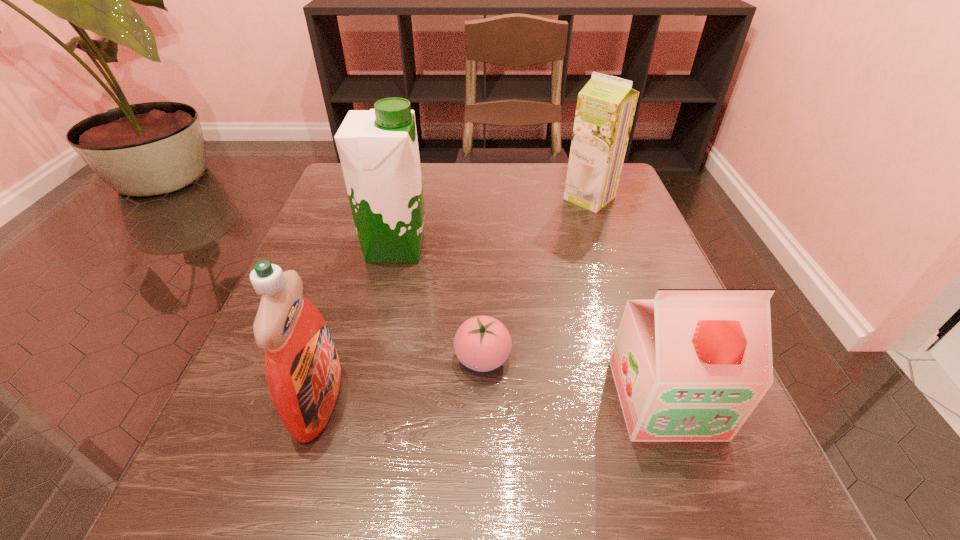
Locate an element on the screen. vacant space located 0.140m on the front surface of the detergent is located at coordinates (439, 400).

Where is `vacant area situated with the cap open on the nearest soya milk`? vacant area situated with the cap open on the nearest soya milk is located at coordinates (694, 480).

Find the location of a particular element. This screenshot has width=960, height=540. free region located on the left of the tomato is located at coordinates (326, 359).

Identify the location of object present at the far edge. Image resolution: width=960 pixels, height=540 pixels. (606, 105).

At what (x,y) coordinates should I click in order to perform the action: click on soya milk that is at the left edge. Please return your answer as a coordinate pair (x, y). Looking at the image, I should click on (378, 148).

Image resolution: width=960 pixels, height=540 pixels. In order to click on detergent that is at the left edge in this screenshot , I will do `click(302, 368)`.

Identify the location of object situated at the far right corner. Image resolution: width=960 pixels, height=540 pixels. (606, 105).

At what (x,y) coordinates should I click in order to perform the action: click on vacant point at the far edge. Please return your answer as a coordinate pair (x, y). Image resolution: width=960 pixels, height=540 pixels. Looking at the image, I should click on (501, 175).

In order to click on vacant area at the near edge of the desktop in this screenshot , I will do `click(450, 468)`.

This screenshot has width=960, height=540. In order to click on vacant region at the left edge of the desktop in this screenshot , I will do [255, 343].